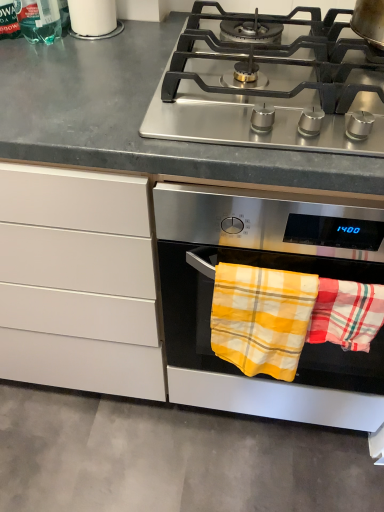
The image size is (384, 512). Identify the location of white glossy cup at upper left. (94, 19).

Describe the element at coordinates (269, 82) in the screenshot. I see `stainless steel gas stove at upper center` at that location.

You are a GUI agent. You are given a task and a screenshot of the screen. Output one action in this format:
    pyautogui.click(x=<x>, y=<y>)
    Task: Click on the yellow plaid towel at lower center, the first beach towel positioned from the left
    This screenshot has height=512, width=384.
    Given the screenshot: What is the action you would take?
    pyautogui.click(x=261, y=318)

Where is `yellow plaid towel at lower right, the 1th beach towel in the right-to-left sequence`? yellow plaid towel at lower right, the 1th beach towel in the right-to-left sequence is located at coordinates (346, 314).

In order to face stainless steel pot at upper right, should I rotate leftwards or rightwards?

Turn right by 28.629 degrees to look at stainless steel pot at upper right.

Where is `stainless steel pot at upper right`? The image size is (384, 512). stainless steel pot at upper right is located at coordinates (369, 21).

You are a GUI agent. You are given a task and a screenshot of the screen. Output one action in this format:
    pyautogui.click(x=<x>, y=<y>)
    Task: Click on the white glossy cup at upper left
    
    Given the screenshot: What is the action you would take?
    pyautogui.click(x=94, y=19)

Is yellow plaid towel at lower right, the second beach towel positioned from the left, aimed at yellow plaid towel at lower center, the 2th beach towel in the right-to-left sequence?

No, yellow plaid towel at lower right, the second beach towel positioned from the left, is not turned towards yellow plaid towel at lower center, the 2th beach towel in the right-to-left sequence.

The width and height of the screenshot is (384, 512). I want to click on beach towel that appears in front of the yellow plaid towel at lower center, the first beach towel positioned from the left, so click(346, 314).

Does yellow plaid towel at lower right, the second beach towel positioned from the left, have a greater height compared to yellow plaid towel at lower center, the 2th beach towel in the right-to-left sequence?

Incorrect, the height of yellow plaid towel at lower right, the second beach towel positioned from the left, is not larger of that of yellow plaid towel at lower center, the 2th beach towel in the right-to-left sequence.

Between stainless steel oven at center and yellow plaid towel at lower right, the 1th beach towel in the right-to-left sequence, which one is positioned in front?

stainless steel oven at center is in front.

Who is taller, stainless steel oven at center or yellow plaid towel at lower right, the 1th beach towel in the right-to-left sequence?

stainless steel oven at center.

Is point (320, 261) closer or farther from the camera than point (374, 303)?

Point (320, 261) is farther from the camera than point (374, 303).

Considering the relative positions of stainless steel oven at center and yellow plaid towel at lower right, the 1th beach towel in the right-to-left sequence, in the image provided, is stainless steel oven at center to the left or to the right of yellow plaid towel at lower right, the 1th beach towel in the right-to-left sequence,?

stainless steel oven at center is to the right of yellow plaid towel at lower right, the 1th beach towel in the right-to-left sequence.

Is white glossy cup at upper left positioned before yellow plaid towel at lower right, the second beach towel positioned from the left?

No, white glossy cup at upper left is behind yellow plaid towel at lower right, the second beach towel positioned from the left.

You are a GUI agent. You are given a task and a screenshot of the screen. Output one action in this format:
    pyautogui.click(x=<x>, y=<y>)
    Task: Click on the appliance above the yellow plaid towel at lower right, the 1th beach towel in the right-to-left sequence (from a real-world perspective)
    The image size is (384, 512).
    Given the screenshot: What is the action you would take?
    tap(94, 19)

Is white glossy cup at upper left positioned beyond the bounds of yellow plaid towel at lower right, the second beach towel positioned from the left?

white glossy cup at upper left is positioned outside yellow plaid towel at lower right, the second beach towel positioned from the left.

Between white glossy cup at upper left and yellow plaid towel at lower right, the second beach towel positioned from the left, which one has smaller size?

yellow plaid towel at lower right, the second beach towel positioned from the left, is smaller.

The height and width of the screenshot is (512, 384). Identify the location of oven lying in front of the translucent green bottle at upper left. (245, 254).

Considering the relative positions of stainless steel oven at center and translucent green bottle at upper left in the image provided, is stainless steel oven at center behind translucent green bottle at upper left?

No, it is in front of translucent green bottle at upper left.

From the image's perspective, between stainless steel oven at center and translucent green bottle at upper left, which one is located above?

translucent green bottle at upper left is shown above in the image.

Between stainless steel oven at center and translucent green bottle at upper left, which one has more height?

With more height is stainless steel oven at center.

Looking at this image, who is smaller, stainless steel pot at upper right or yellow plaid towel at lower center, the 2th beach towel in the right-to-left sequence?

With smaller size is yellow plaid towel at lower center, the 2th beach towel in the right-to-left sequence.

Consider the image. How far apart are stainless steel pot at upper right and yellow plaid towel at lower center, the first beach towel positioned from the left?

stainless steel pot at upper right and yellow plaid towel at lower center, the first beach towel positioned from the left, are 20.78 inches apart from each other.

Is stainless steel pot at upper right turned away from yellow plaid towel at lower center, the first beach towel positioned from the left?

No, yellow plaid towel at lower center, the first beach towel positioned from the left, is not at the back of stainless steel pot at upper right.

Is stainless steel pot at upper right not close to yellow plaid towel at lower center, the 2th beach towel in the right-to-left sequence?

No, stainless steel pot at upper right is not far away from yellow plaid towel at lower center, the 2th beach towel in the right-to-left sequence.

Considering the sizes of objects stainless steel oven at center and stainless steel pot at upper right in the image provided, who is smaller, stainless steel oven at center or stainless steel pot at upper right?

stainless steel pot at upper right.

Is stainless steel oven at center at the right side of stainless steel pot at upper right?

In fact, stainless steel oven at center is to the left of stainless steel pot at upper right.

Is stainless steel oven at center shorter than stainless steel pot at upper right?

In fact, stainless steel oven at center may be taller than stainless steel pot at upper right.

From a real-world perspective, which is physically below, stainless steel pot at upper right or white glossy cup at upper left?

white glossy cup at upper left, from a real-world perspective.

Between stainless steel pot at upper right and white glossy cup at upper left, which one has smaller size?

white glossy cup at upper left.

Can you tell me how much stainless steel pot at upper right and white glossy cup at upper left differ in facing direction?

The facing directions of stainless steel pot at upper right and white glossy cup at upper left are 3.03 degrees apart.

Find the location of a particular element. kitchen appliance in front of the white glossy cup at upper left is located at coordinates click(x=369, y=21).

This screenshot has height=512, width=384. Identify the location of beach towel in front of the yellow plaid towel at lower center, the first beach towel positioned from the left. (346, 314).

Identify the location of oven that appears below the yellow plaid towel at lower right, the second beach towel positioned from the left (from a real-world perspective). (245, 254).

From the picture: Looking at the image, which one is located further to translucent green bottle at upper left, stainless steel oven at center or yellow plaid towel at lower right, the second beach towel positioned from the left?

Among the two, yellow plaid towel at lower right, the second beach towel positioned from the left, is located further to translucent green bottle at upper left.

Based on their spatial positions, is yellow plaid towel at lower center, the 2th beach towel in the right-to-left sequence, or white glossy cup at upper left closer to stainless steel oven at center?

Based on the image, yellow plaid towel at lower center, the 2th beach towel in the right-to-left sequence, appears to be nearer to stainless steel oven at center.

From the image, which object appears to be farther from stainless steel pot at upper right, stainless steel oven at center or yellow plaid towel at lower right, the second beach towel positioned from the left?

stainless steel oven at center is further to stainless steel pot at upper right.

From the image, which object appears to be farther from stainless steel oven at center, white glossy cup at upper left or translucent green bottle at upper left?

translucent green bottle at upper left lies further to stainless steel oven at center than the other object.

Which object lies further to the anchor point stainless steel pot at upper right, yellow plaid towel at lower center, the 2th beach towel in the right-to-left sequence, or white glossy cup at upper left?

Based on the image, white glossy cup at upper left appears to be further to stainless steel pot at upper right.

Based on their spatial positions, is yellow plaid towel at lower center, the 2th beach towel in the right-to-left sequence, or stainless steel oven at center further from stainless steel gas stove at upper center?

yellow plaid towel at lower center, the 2th beach towel in the right-to-left sequence, lies further to stainless steel gas stove at upper center than the other object.

Which object lies nearer to the anchor point stainless steel gas stove at upper center, yellow plaid towel at lower center, the first beach towel positioned from the left, or stainless steel pot at upper right?

The object closer to stainless steel gas stove at upper center is stainless steel pot at upper right.

When comparing their distances from stainless steel gas stove at upper center, does stainless steel pot at upper right or yellow plaid towel at lower right, the 1th beach towel in the right-to-left sequence, seem closer?

stainless steel pot at upper right is positioned closer to the anchor stainless steel gas stove at upper center.

I want to click on gas stove between white glossy cup at upper left and stainless steel oven at center from left to right, so click(x=269, y=82).

The image size is (384, 512). Identify the location of gas stove between translucent green bottle at upper left and stainless steel pot at upper right in the horizontal direction. (269, 82).

What are the coordinates of `gas stove between translucent green bottle at upper left and yellow plaid towel at lower right, the second beach towel positioned from the left, from top to bottom` in the screenshot? It's located at (269, 82).

Find the location of `gas stove between white glossy cup at upper left and yellow plaid towel at lower right, the 1th beach towel in the right-to-left sequence, vertically`. gas stove between white glossy cup at upper left and yellow plaid towel at lower right, the 1th beach towel in the right-to-left sequence, vertically is located at coordinates (269, 82).